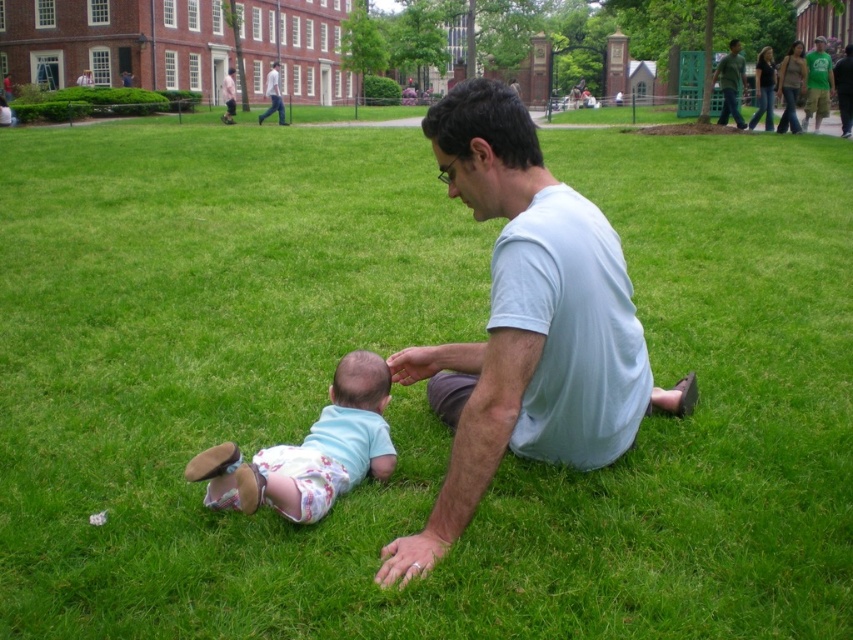
A parent is trying to decide whether to place a blanket between the light blue cotton shirt at center and the light blue fabric baby at center. The blanket is 28 inches long. Will the blanket fit between them?

The light blue cotton shirt at center is 30.02 inches from light blue fabric baby at center. Since the blanket is 28 inches long, it is shorter than the distance between them, so the blanket will fit between them.

You are a photographer standing at the edge of the grassy area. You notice two people in the distance wearing the green cotton shirt at upper right and the pink fabric shirt at upper center. Which of these two shirts is positioned lower in the image?

The green cotton shirt at upper right is located below the pink fabric shirt at upper center, so it is positioned lower in the image.